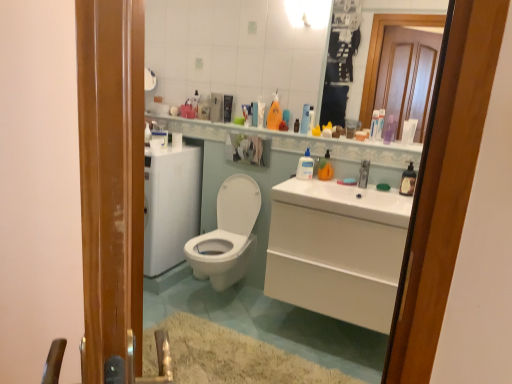
I want to click on unoccupied area in front of translucent plastic bottle at right, which ranks as the 4th cleaning product in left-to-right order, so click(x=402, y=200).